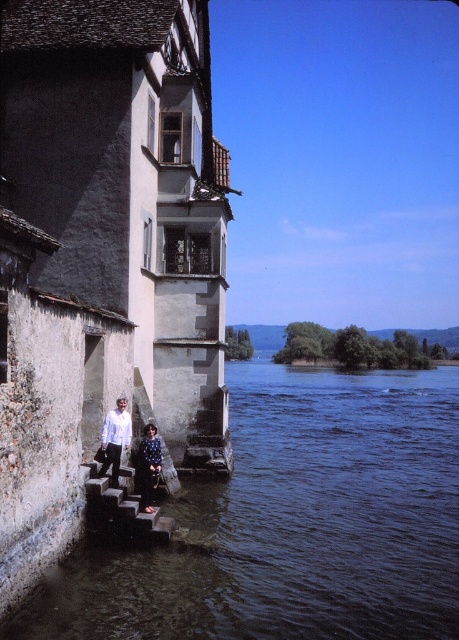
Who is lower down, stone steps at lower left or dark blue dress at lower left?

stone steps at lower left is lower down.

Is stone steps at lower left below dark blue dress at lower left?

Yes.

At what (x,y) coordinates should I click in order to perform the action: click on stone steps at lower left. Please return your answer as a coordinate pair (x, y). Looking at the image, I should click on (119, 508).

Locate an element on the screen. The image size is (459, 640). stone steps at lower left is located at coordinates (119, 508).

Is dark blue water at lower center to the right of dark blue dress at lower left from the viewer's perspective?

Indeed, dark blue water at lower center is positioned on the right side of dark blue dress at lower left.

Which is behind, point (339, 600) or point (140, 481)?

Positioned behind is point (140, 481).

I want to click on dark blue water at lower center, so click(291, 524).

I want to click on dark blue water at lower center, so click(x=291, y=524).

Can you confirm if stone steps at lower left is bigger than white matte shirt at lower left?

Yes, stone steps at lower left is bigger than white matte shirt at lower left.

Between stone steps at lower left and white matte shirt at lower left, which one is positioned higher?

white matte shirt at lower left

Between point (88, 524) and point (106, 438), which one is positioned in front?

Point (88, 524) is more forward.

This screenshot has width=459, height=640. I want to click on stone steps at lower left, so click(119, 508).